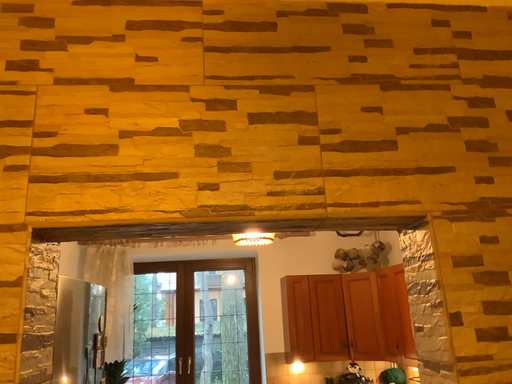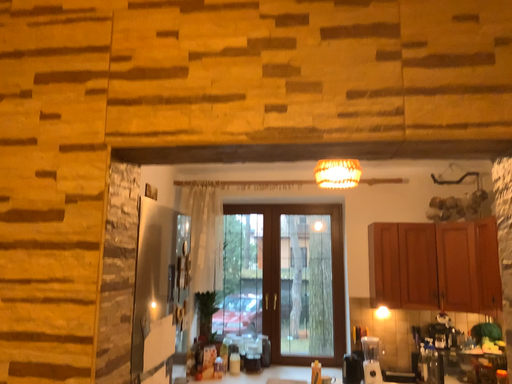
Question: Which way did the camera rotate in the video?

Choices:
 (A) rotated downward
 (B) rotated upward

Answer: (A)